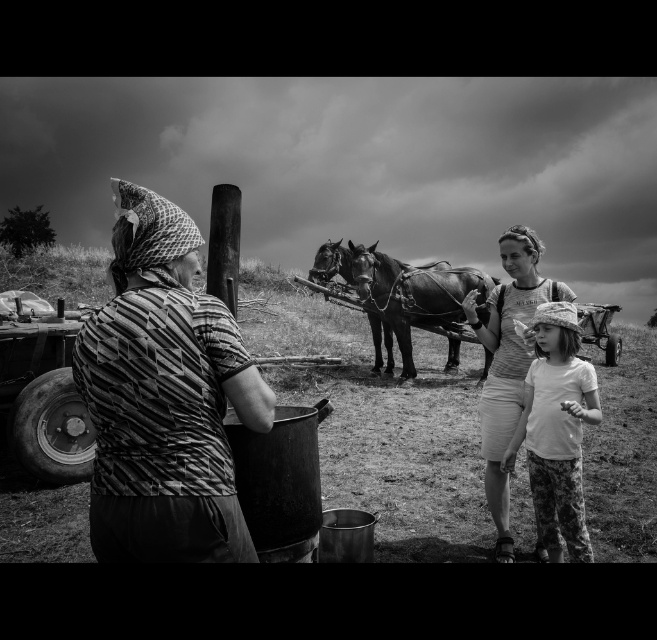
In the scene described, there is a matte fabric woman at center and a smooth leather horse at center. Which object takes up more space in the image?

The smooth leather horse at center takes up more space in the image because it is larger than the matte fabric woman at center.

You are a photographer trying to capture a clear shot of both the matte fabric woman at center and the smooth leather horse at center. Which one will appear larger in your photo?

The matte fabric woman at center will appear larger in the photo because she is closer to the viewer than the smooth leather horse at center.